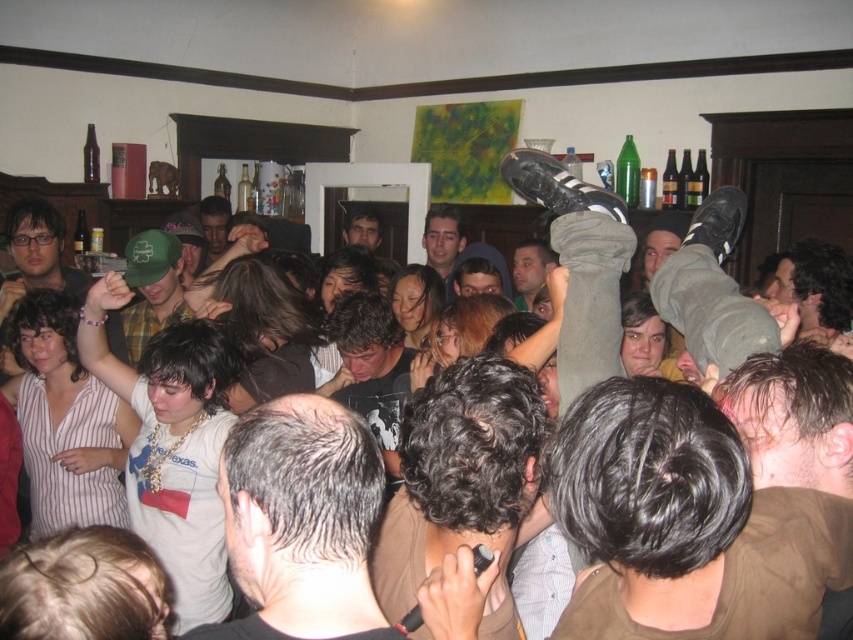
Can you confirm if green plaid shirt at center is thinner than matte black shirt at center?

In fact, green plaid shirt at center might be wider than matte black shirt at center.

Image resolution: width=853 pixels, height=640 pixels. I want to click on green plaid shirt at center, so click(x=152, y=288).

This screenshot has width=853, height=640. Find the location of `green plaid shirt at center`. green plaid shirt at center is located at coordinates (152, 288).

Who is more forward, (343, 620) or (142, 276)?

Point (343, 620)

The height and width of the screenshot is (640, 853). Describe the element at coordinates (300, 522) in the screenshot. I see `dark gray hair at center` at that location.

Image resolution: width=853 pixels, height=640 pixels. I want to click on dark gray hair at center, so pyautogui.click(x=300, y=522).

Can you confirm if matte black shirt at center is positioned above dark brown hair at center?

No.

Is point (49, 225) positioned before point (375, 240)?

Yes, it is.

The height and width of the screenshot is (640, 853). I want to click on matte black shirt at center, so click(39, 250).